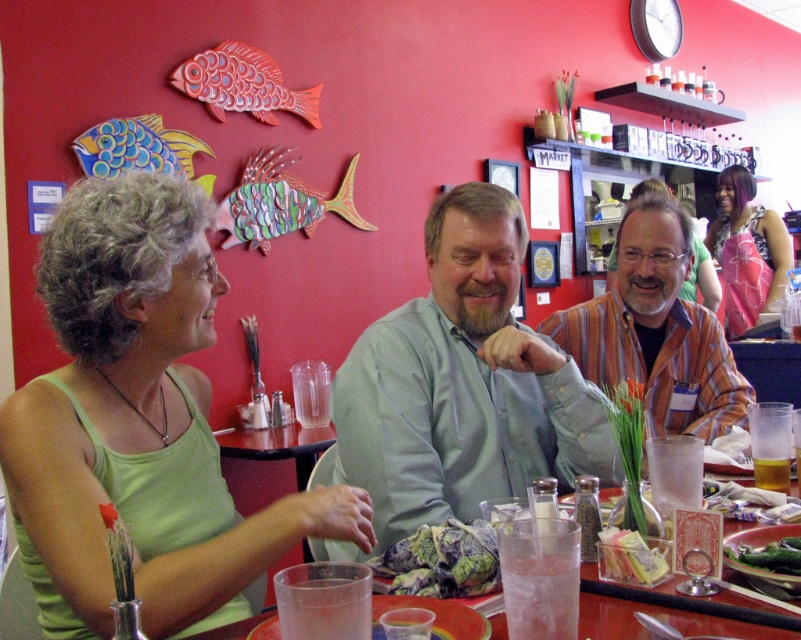
In the scene shown: You are a waiter in this restaurant and need to deliver a drink to the customer. The customer is seated at the table with both the clear plastic cups at center and the translucent glass cup at table center. Which cup should you place the drink into if you want it to be visible to the customer from the entrance?

The clear plastic cups at center are in front of the translucent glass cup at table center, so placing the drink in the clear plastic cups at center would make it more visible to the customer from the entrance.

You are a customer at this restaurant and want to grab a drink. There are clear plastic cups at center and a translucent glass cup at table center. Which cup is located lower on the table?

The clear plastic cups at center are located lower on the table since they are positioned below the translucent glass cup at table center.